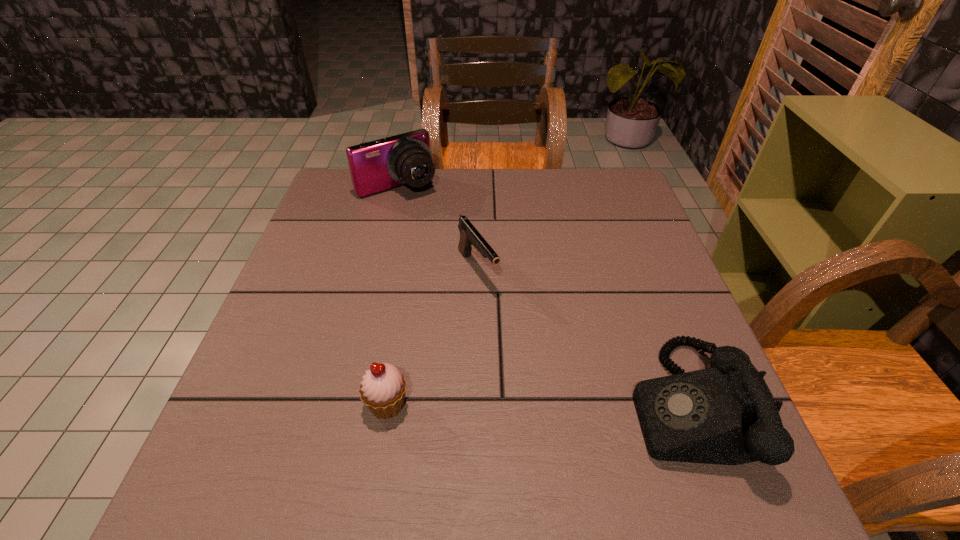
Locate an element on the screen. The image size is (960, 540). object positioned at the far left corner is located at coordinates click(375, 166).

Locate an element on the screen. The height and width of the screenshot is (540, 960). object at the near right corner is located at coordinates (726, 414).

Locate an element on the screen. The width and height of the screenshot is (960, 540). free space at the far edge of the desktop is located at coordinates (446, 185).

Image resolution: width=960 pixels, height=540 pixels. I want to click on blank space at the near edge of the desktop, so click(x=466, y=408).

This screenshot has height=540, width=960. In the image, there is a desktop. Find the location of `vacant space at the left edge`. vacant space at the left edge is located at coordinates (333, 214).

This screenshot has height=540, width=960. I want to click on vacant space at the right edge of the desktop, so click(x=600, y=219).

Identify the location of vacant area at the far right corner. (629, 183).

This screenshot has width=960, height=540. I want to click on vacant space that is in between the pistol and the farthest object, so click(x=438, y=228).

This screenshot has height=540, width=960. In order to click on vacant space in between the telephone and the camera in this screenshot , I will do `click(541, 296)`.

Locate an element on the screen. The height and width of the screenshot is (540, 960). free space between the rightmost object and the cupcake is located at coordinates (536, 404).